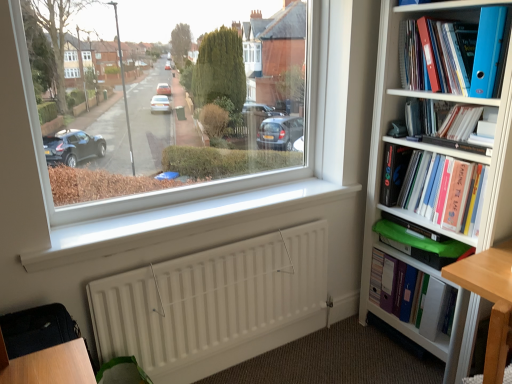
At what (x,y) coordinates should I click in order to perform the action: click on vacant area situated to the left side of white plastic shelf at lower right. Please return your answer as a coordinate pair (x, y). This screenshot has width=512, height=384. Looking at the image, I should click on (351, 350).